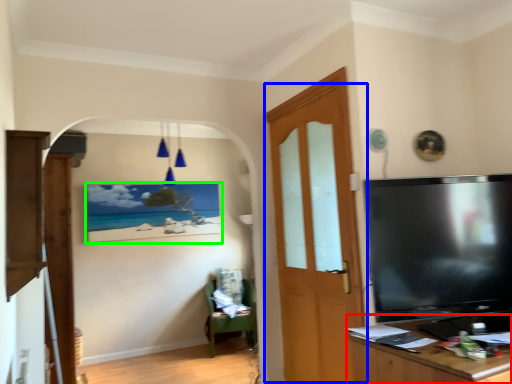
Question: Which is farther away from desk (highlighted by a red box)? door (highlighted by a blue box) or picture frame (highlighted by a green box)?

Choices:
 (A) door
 (B) picture frame

Answer: (B)